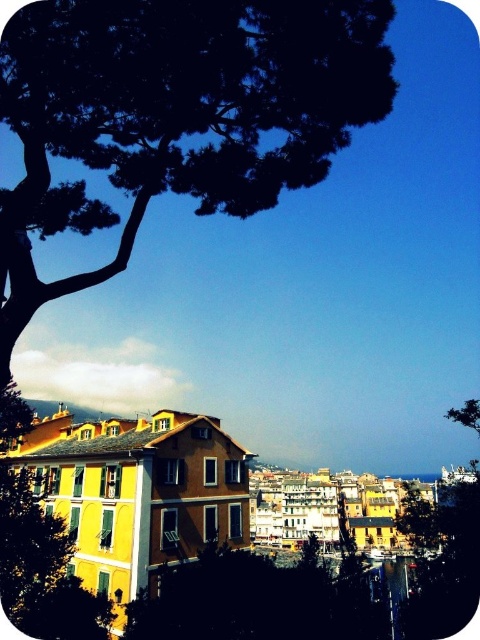
Looking at this image, you are planning to install a new streetlight in the coastal town. The dark green textured tree at upper left and the green matte tree at upper left are both potential locations. Given that the minimum distance required between trees and streetlights is 150 feet for safety, which tree would you choose and why?

The dark green textured tree at upper left and green matte tree at upper left are 153.52 feet apart. Since the required distance is 150 feet, either tree could be chosen as the distance exceeds the minimum requirement. However, the exact choice depends on other factors like visibility and obstruction, but based on distance alone, both are suitable.